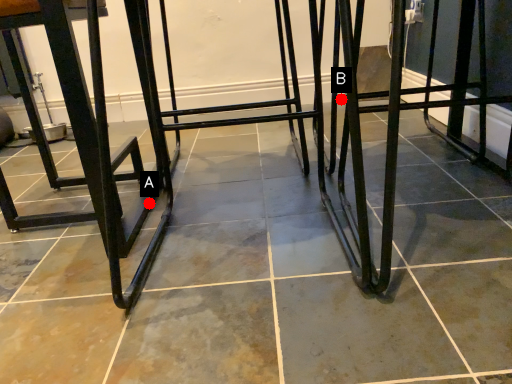
Question: Two points are circled on the image, labeled by A and B beside each circle. Which point is farther to the camera?

Choices:
 (A) A is further
 (B) B is further

Answer: (A)